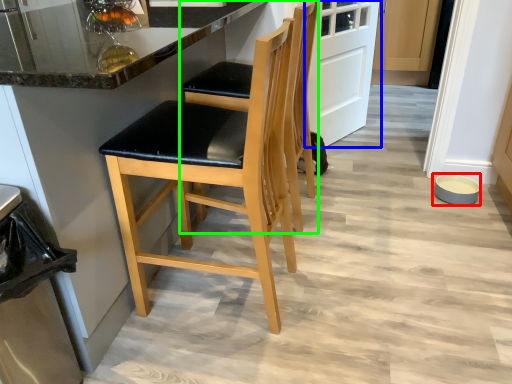
Question: Estimate the real-world distances between objects in this image. Which object is closer to bowl (highlighted by a red box), door (highlighted by a blue box) or chair (highlighted by a green box)?

Choices:
 (A) door
 (B) chair

Answer: (A)